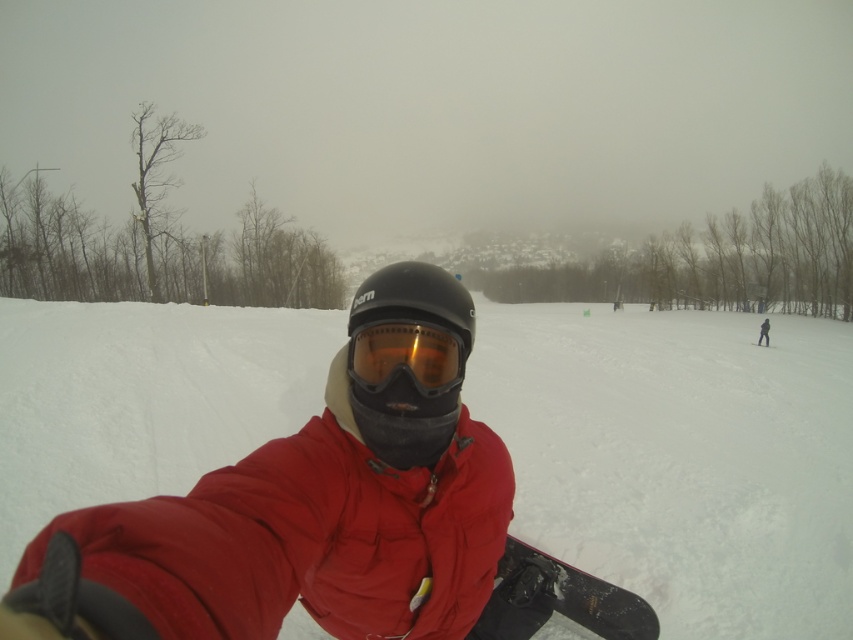
Question: Which of the following is the closest to the observer?

Choices:
 (A) (463, 349)
 (B) (604, 396)
 (C) (529, 604)

Answer: (A)

Question: Is white matte snow at center to the right of matte black helmet at center from the viewer's perspective?

Choices:
 (A) yes
 (B) no

Answer: (A)

Question: Which object is farther from the camera taking this photo?

Choices:
 (A) black matte snowboard at lower center
 (B) orange reflective lens at center

Answer: (A)

Question: Estimate the real-world distances between objects in this image. Which object is closer to the matte black helmet at center?

Choices:
 (A) orange reflective lens at center
 (B) white matte snow at center
 (C) black matte snowboard at lower center

Answer: (A)

Question: Is black matte snowboard at lower center thinner than orange reflective lens at center?

Choices:
 (A) no
 (B) yes

Answer: (A)

Question: Can you confirm if matte black helmet at center is positioned above black matte snowboard at lower center?

Choices:
 (A) yes
 (B) no

Answer: (A)